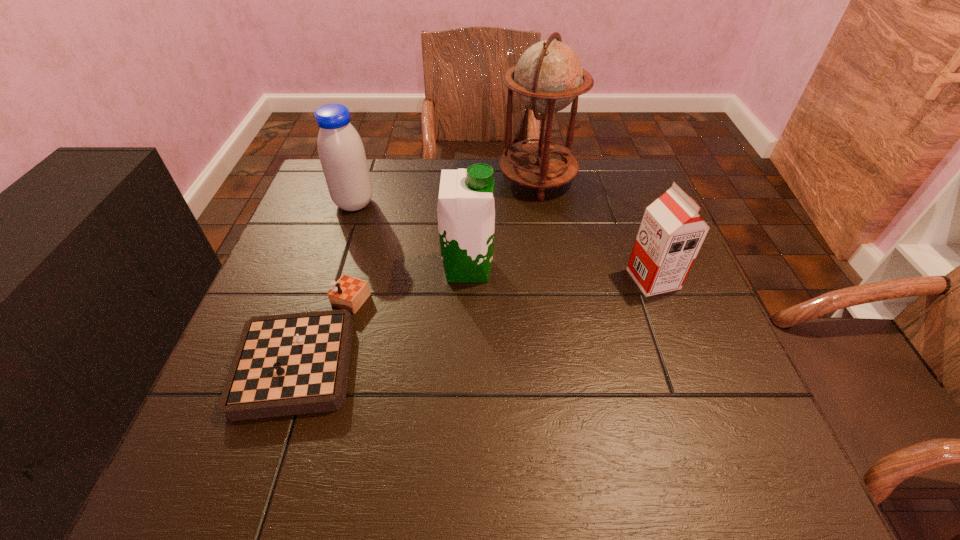
This screenshot has height=540, width=960. In the image, there is a desktop. Identify the location of free space at the near edge. (376, 451).

In the image, there is a desktop. Where is `vacant space at the left edge`? vacant space at the left edge is located at coordinates (309, 268).

Image resolution: width=960 pixels, height=540 pixels. What are the coordinates of `free space at the right edge of the desktop` in the screenshot? It's located at (669, 396).

Where is `vacant area that lies between the second soya milk from right to left and the second object from right to left`? vacant area that lies between the second soya milk from right to left and the second object from right to left is located at coordinates (502, 224).

Identify the location of free point between the farthest soya milk and the third object from left to right. (411, 236).

The height and width of the screenshot is (540, 960). I want to click on vacant region between the farthest soya milk and the shortest object, so click(x=328, y=274).

At what (x,y) coordinates should I click in order to perform the action: click on vacant area between the rightmost soya milk and the leftmost soya milk. Please return your answer as a coordinate pair (x, y). Looking at the image, I should click on (504, 241).

Find the location of a particular element. free space between the farthest soya milk and the rightmost soya milk is located at coordinates (504, 241).

At what (x,y) coordinates should I click in order to perform the action: click on free space between the chessboard and the farthest soya milk. Please return your answer as a coordinate pair (x, y). This screenshot has height=540, width=960. Looking at the image, I should click on (328, 274).

This screenshot has height=540, width=960. Find the location of `free space between the chessboard and the leftmost soya milk`. free space between the chessboard and the leftmost soya milk is located at coordinates (328, 274).